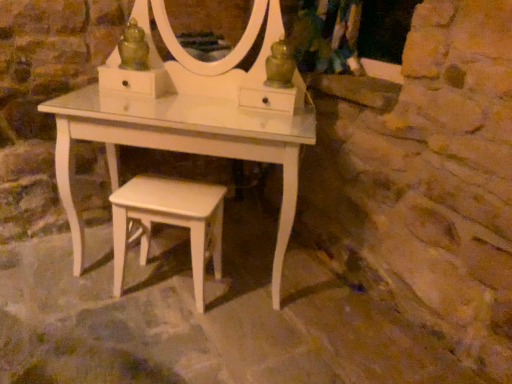
The image size is (512, 384). I want to click on free location above white matte stool at center (from a real-world perspective), so click(x=170, y=195).